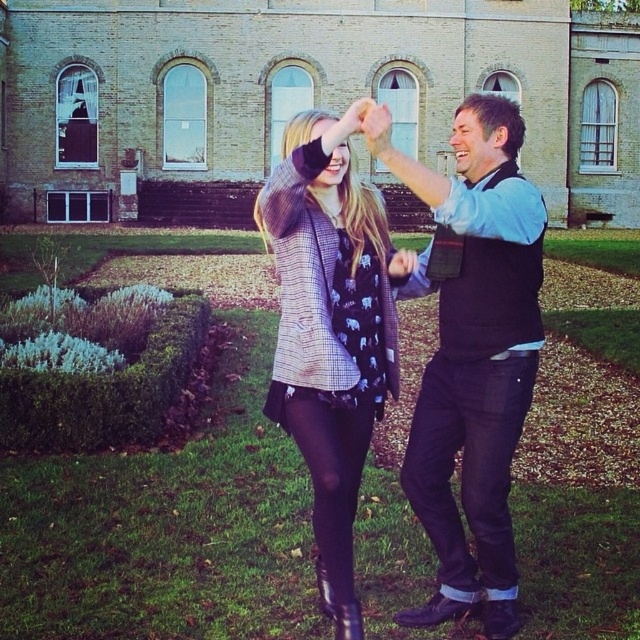
In the scene shown: Is black matte vest at center taller than plaid woolen jacket at center?

Yes, black matte vest at center is taller than plaid woolen jacket at center.

The width and height of the screenshot is (640, 640). What do you see at coordinates (472, 353) in the screenshot? I see `black matte vest at center` at bounding box center [472, 353].

The height and width of the screenshot is (640, 640). What are the coordinates of `black matte vest at center` in the screenshot? It's located at (472, 353).